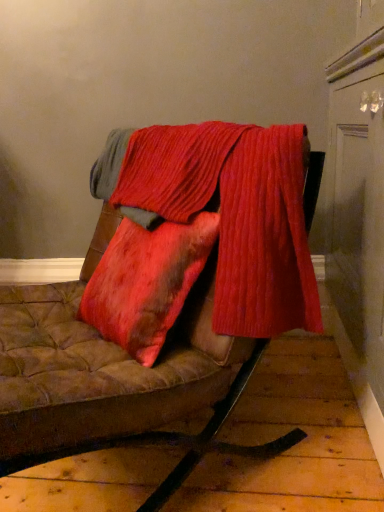
Question: Considering the relative positions of ribbed red fabric at center and velvet-like brown cushion at center in the image provided, is ribbed red fabric at center in front of velvet-like brown cushion at center?

Choices:
 (A) no
 (B) yes

Answer: (A)

Question: From a real-world perspective, is ribbed red fabric at center under velvet-like brown cushion at center?

Choices:
 (A) yes
 (B) no

Answer: (B)

Question: Is ribbed red fabric at center thinner than velvet-like brown cushion at center?

Choices:
 (A) yes
 (B) no

Answer: (A)

Question: Is ribbed red fabric at center to the left of velvet-like brown cushion at center from the viewer's perspective?

Choices:
 (A) no
 (B) yes

Answer: (A)

Question: Is the surface of ribbed red fabric at center in direct contact with velvet-like brown cushion at center?

Choices:
 (A) yes
 (B) no

Answer: (B)

Question: Can you confirm if ribbed red fabric at center is bigger than velvet-like brown cushion at center?

Choices:
 (A) no
 (B) yes

Answer: (A)

Question: Is velvet-like brown cushion at center located outside ribbed red fabric at center?

Choices:
 (A) no
 (B) yes

Answer: (B)

Question: Considering the relative sizes of velvet-like brown cushion at center and ribbed red fabric at center in the image provided, is velvet-like brown cushion at center bigger than ribbed red fabric at center?

Choices:
 (A) no
 (B) yes

Answer: (B)

Question: Is velvet-like brown cushion at center looking in the opposite direction of ribbed red fabric at center?

Choices:
 (A) yes
 (B) no

Answer: (A)

Question: From the image's perspective, is velvet-like brown cushion at center beneath ribbed red fabric at center?

Choices:
 (A) yes
 (B) no

Answer: (A)

Question: Is ribbed red fabric at center inside velvet-like brown cushion at center?

Choices:
 (A) yes
 (B) no

Answer: (A)

Question: Does velvet-like brown cushion at center have a lesser width compared to ribbed red fabric at center?

Choices:
 (A) yes
 (B) no

Answer: (B)

Question: In the image, is velvet-like brown cushion at center positioned in front of or behind ribbed red fabric at center?

Choices:
 (A) front
 (B) behind

Answer: (A)